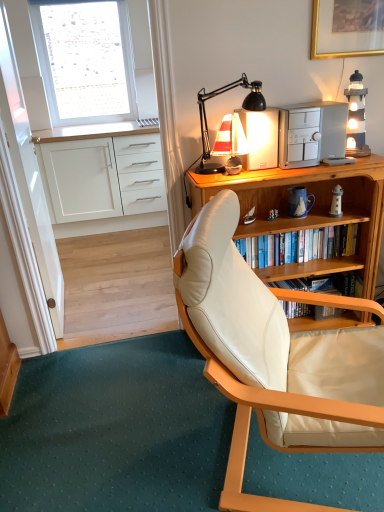
Question: Considering the relative positions of white matte cabinet at left and beige leather chair at center in the image provided, is white matte cabinet at left to the left or to the right of beige leather chair at center?

Choices:
 (A) left
 (B) right

Answer: (A)

Question: From a real-world perspective, is white matte cabinet at left physically located above or below beige leather chair at center?

Choices:
 (A) below
 (B) above

Answer: (A)

Question: Considering the real-world distances, which object is farthest from the white fabric window at upper left?

Choices:
 (A) black matte desk lamp at upper right, which is the 2th lamp in right-to-left order
 (B) wooden bookshelf at center
 (C) white matte cabinet at left
 (D) wooden desk at center
 (E) white plastic phone at upper right

Answer: (E)

Question: Based on their relative distances, which object is nearer to the transparent glass door at left?

Choices:
 (A) gold-framed picture at upper right
 (B) white plastic phone at upper right
 (C) white fabric window at upper left
 (D) wooden bookshelf at center
 (E) black matte desk lamp at upper right, placed as the 1th lamp when sorted from left to right

Answer: (E)